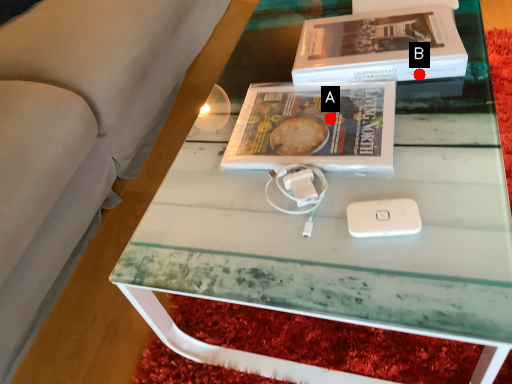
Question: Two points are circled on the image, labeled by A and B beside each circle. Which point is closer to the camera?

Choices:
 (A) A is closer
 (B) B is closer

Answer: (A)